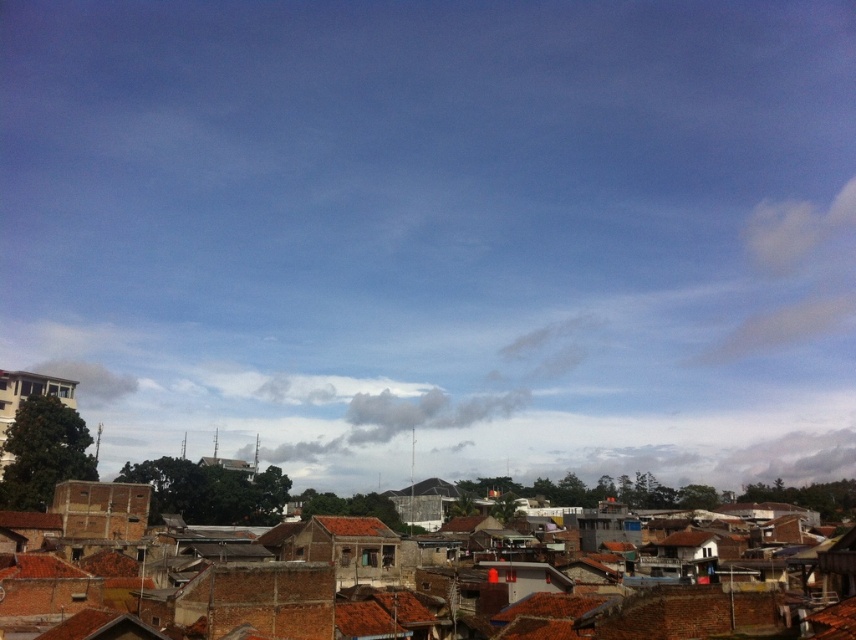
You are an architect analyzing the urban layout. You observe the brown clay rooftops at center and the brown tile roof at center. Which of these two is located to the right when viewed from the front?

The brown clay rooftops at center is positioned on the right side of brown tile roof at center, so it is located to the right when viewed from the front.

You are standing in the urban area and want to take a photo of the brown tile roof at center without the brown clay rooftops at center blocking the view. Is this possible?

The brown tile roof at center is behind brown clay rooftops at center, so it will be blocked by them. To take a clear photo, you need to move to a position where you can see the brown tile roof at center beyond the brown clay rooftops at center.